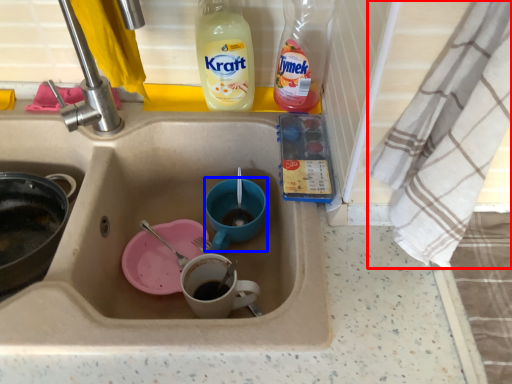
Question: Which object is closer to the camera taking this photo, cloth (highlighted by a red box) or basin (highlighted by a blue box)?

Choices:
 (A) cloth
 (B) basin

Answer: (A)